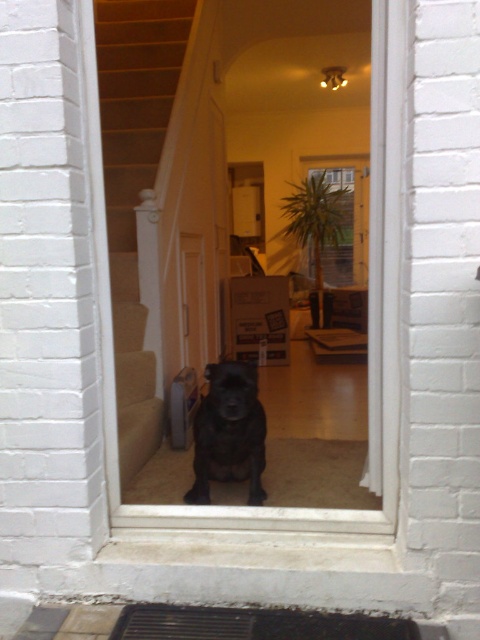
Is dark brown textured mat at lower center thinner than shiny black dog at center?

No, dark brown textured mat at lower center is not thinner than shiny black dog at center.

Can you confirm if dark brown textured mat at lower center is positioned to the right of shiny black dog at center?

Correct, you'll find dark brown textured mat at lower center to the right of shiny black dog at center.

Is point (241, 628) positioned behind point (248, 445)?

No, it is in front of (248, 445).

The image size is (480, 640). I want to click on dark brown textured mat at lower center, so click(x=253, y=624).

Which of these two, carpeted stairs at center or shiny black dog at center, stands shorter?

Standing shorter between the two is shiny black dog at center.

Does carpeted stairs at center appear on the right side of shiny black dog at center?

Incorrect, carpeted stairs at center is not on the right side of shiny black dog at center.

Between point (192, 10) and point (253, 364), which one is positioned in front?

Point (253, 364) is more forward.

At what (x,y) coordinates should I click in order to perform the action: click on carpeted stairs at center. Please return your answer as a coordinate pair (x, y). This screenshot has width=480, height=640. Looking at the image, I should click on (134, 188).

Find the location of a particular element. carpeted stairs at center is located at coordinates (134, 188).

Is point (108, 108) farther from viewer compared to point (396, 628)?

Yes.

The height and width of the screenshot is (640, 480). In order to click on carpeted stairs at center in this screenshot , I will do `click(134, 188)`.